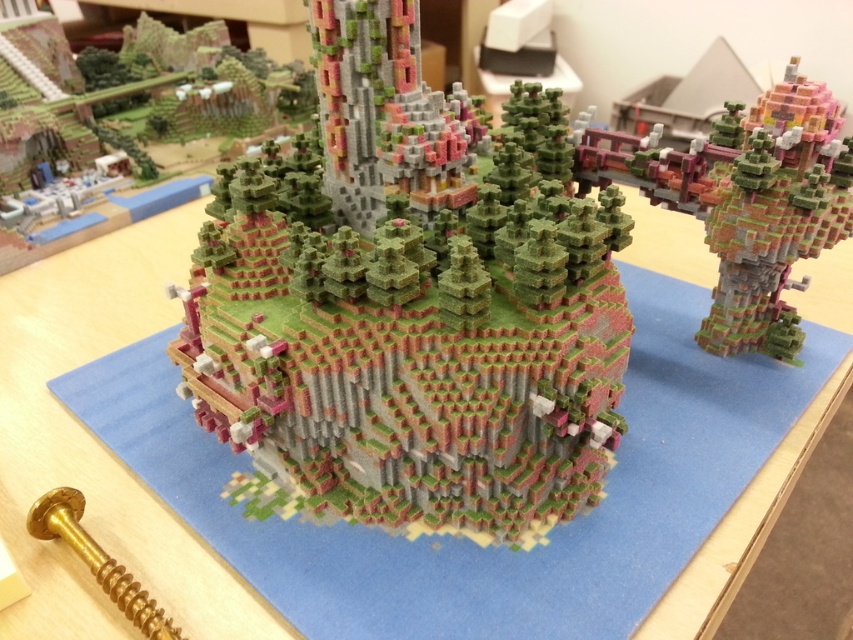
Is pixelated green tower at center thinner than matte pink and green tower at center?

Incorrect, pixelated green tower at center's width is not less than matte pink and green tower at center's.

Does pixelated green tower at center have a lesser height compared to matte pink and green tower at center?

Incorrect, pixelated green tower at center's height does not fall short of matte pink and green tower at center's.

The height and width of the screenshot is (640, 853). I want to click on pixelated green tower at center, so click(408, 314).

Which of these two, pixelated green tower at center or gold metallic screw at lower left, stands shorter?

Standing shorter between the two is gold metallic screw at lower left.

Which is more to the left, pixelated green tower at center or gold metallic screw at lower left?

From the viewer's perspective, gold metallic screw at lower left appears more on the left side.

Is point (228, 422) closer to camera compared to point (76, 509)?

No, it is not.

I want to click on pixelated green tower at center, so click(408, 314).

Can you confirm if matte pink and green tower at center is taller than gold metallic screw at lower left?

Indeed, matte pink and green tower at center has a greater height compared to gold metallic screw at lower left.

Does matte pink and green tower at center appear on the right side of gold metallic screw at lower left?

Correct, you'll find matte pink and green tower at center to the right of gold metallic screw at lower left.

Where is `matte pink and green tower at center`? The width and height of the screenshot is (853, 640). matte pink and green tower at center is located at coordinates (746, 202).